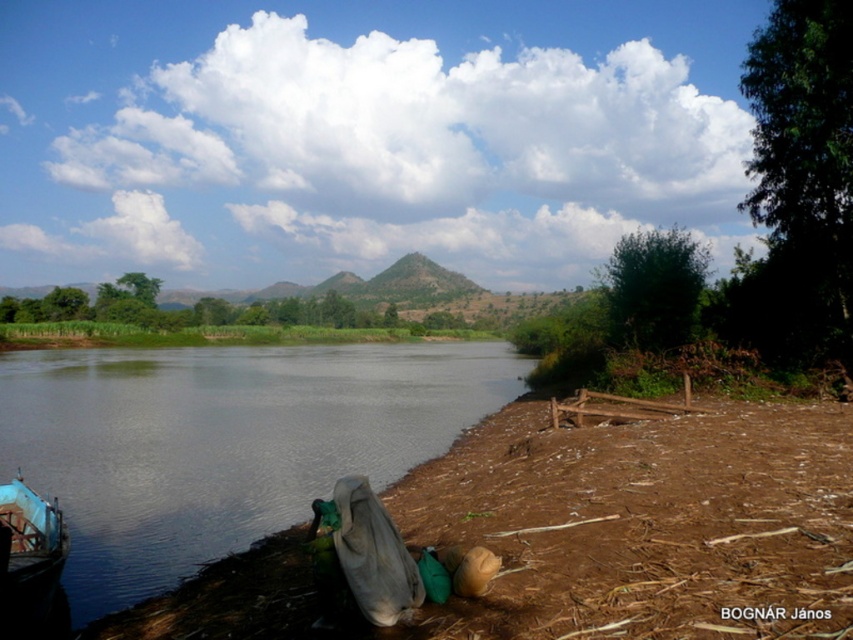
Question: Can you confirm if smooth dark water at lower left is positioned to the right of blue wooden boat at lower left?

Choices:
 (A) no
 (B) yes

Answer: (A)

Question: Is brown dirt at lower left to the right of smooth dark water at lower left from the viewer's perspective?

Choices:
 (A) yes
 (B) no

Answer: (A)

Question: Which of the following is the farthest from the observer?

Choices:
 (A) smooth dark water at lower left
 (B) brown dirt at lower left

Answer: (A)

Question: Which object appears farthest from the camera in this image?

Choices:
 (A) brown dirt at lower left
 (B) smooth dark water at lower left
 (C) blue wooden boat at lower left

Answer: (B)

Question: Can you confirm if brown dirt at lower left is positioned to the right of blue wooden boat at lower left?

Choices:
 (A) no
 (B) yes

Answer: (B)

Question: Which point is farther to the camera?

Choices:
 (A) (59, 536)
 (B) (650, 630)

Answer: (A)